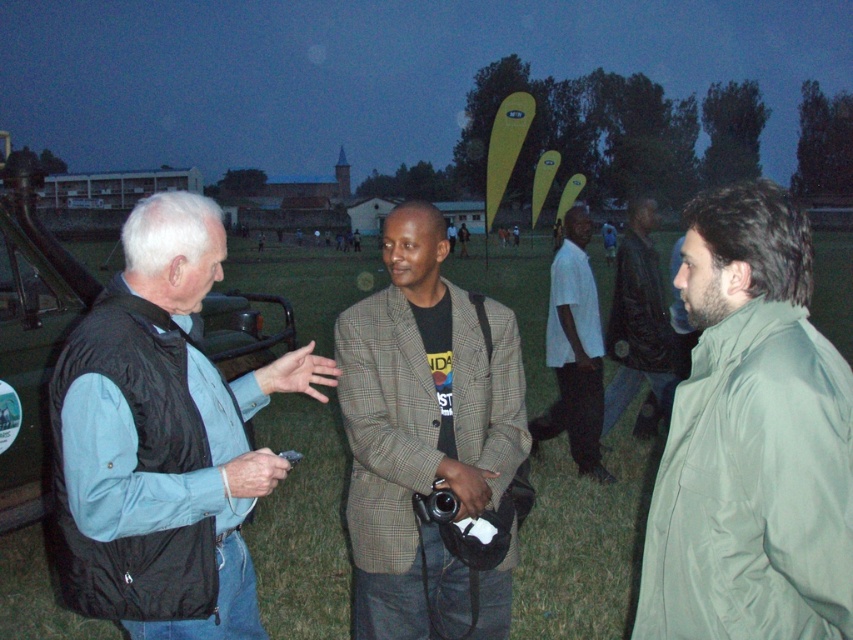
Question: Does plaid fabric blazer at center have a larger size compared to white cotton shirt at center?

Choices:
 (A) no
 (B) yes

Answer: (B)

Question: Among these points, which one is nearest to the camera?

Choices:
 (A) (706, 540)
 (B) (669, 352)
 (C) (569, 262)
 (D) (167, 316)

Answer: (A)

Question: Observing the image, what is the correct spatial positioning of black synthetic vest at left in reference to leather jacket at center?

Choices:
 (A) right
 (B) left

Answer: (B)

Question: Which object appears closest to the camera in this image?

Choices:
 (A) white cotton shirt at center
 (B) black synthetic vest at left
 (C) leather jacket at center
 (D) olive-green fabric jacket at right

Answer: (D)

Question: Which point is closer to the camera?

Choices:
 (A) (558, 314)
 (B) (462, 624)
 (C) (648, 422)

Answer: (B)

Question: Does olive-green fabric jacket at right have a greater width compared to black synthetic vest at left?

Choices:
 (A) no
 (B) yes

Answer: (A)